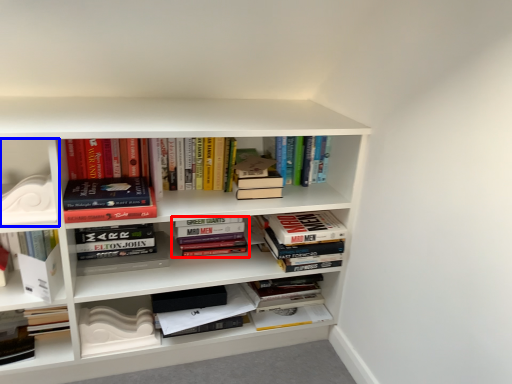
Question: Which point is further to the camera, book (highlighted by a red box) or shelf (highlighted by a blue box)?

Choices:
 (A) book
 (B) shelf

Answer: (A)